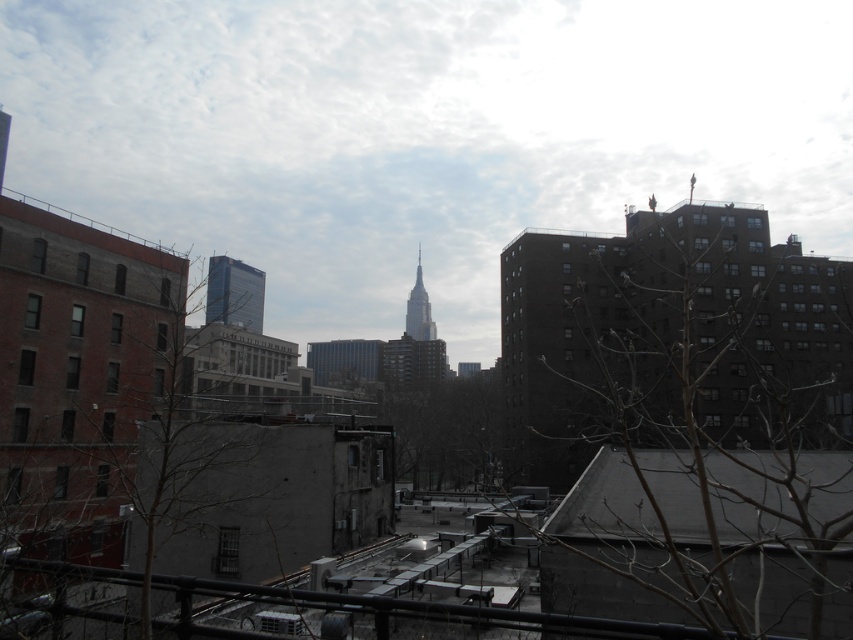
You are standing on a rooftop and looking at two points marked in the image. The first point is at coordinates point (254,268) and the second is at point (421,282). Which point is closer to you?

Point (254,268) is in front of point (421,282), so the first point is closer to you.

In the scene shown: You are an architect analyzing the urban skyline. You observe the smooth glass skyscraper at center and the smooth glass spire at center. Which structure has a greater overall height?

The smooth glass skyscraper at center is larger in size than the smooth glass spire at center, so it has a greater overall height.

You are standing on the rooftop where the image was taken. You notice a point marked at coordinate (234, 292). What does this point indicate in the scene?

The point at coordinate (234, 292) indicates the location of the smooth glass skyscraper at center.